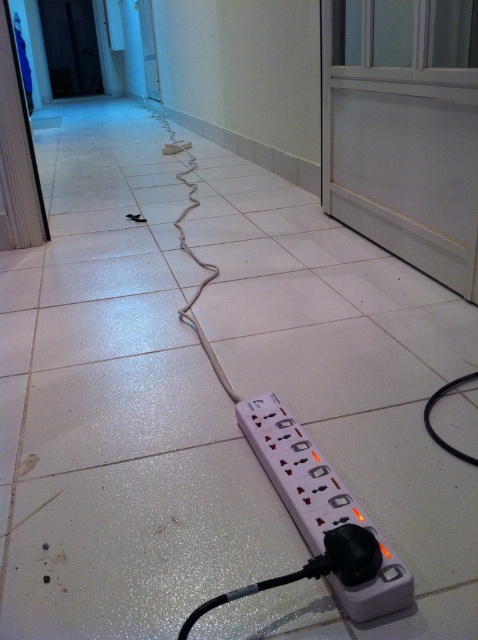
Between white plastic power strip at center and black rubber wire at lower center, which one has less height?

Standing shorter between the two is black rubber wire at lower center.

Is the position of white plastic power strip at center more distant than that of black rubber wire at lower center?

No, white plastic power strip at center is closer to the viewer.

Is point (252, 440) positioned behind point (424, 408)?

That is False.

Image resolution: width=478 pixels, height=640 pixels. Identify the location of white plastic power strip at center. (319, 502).